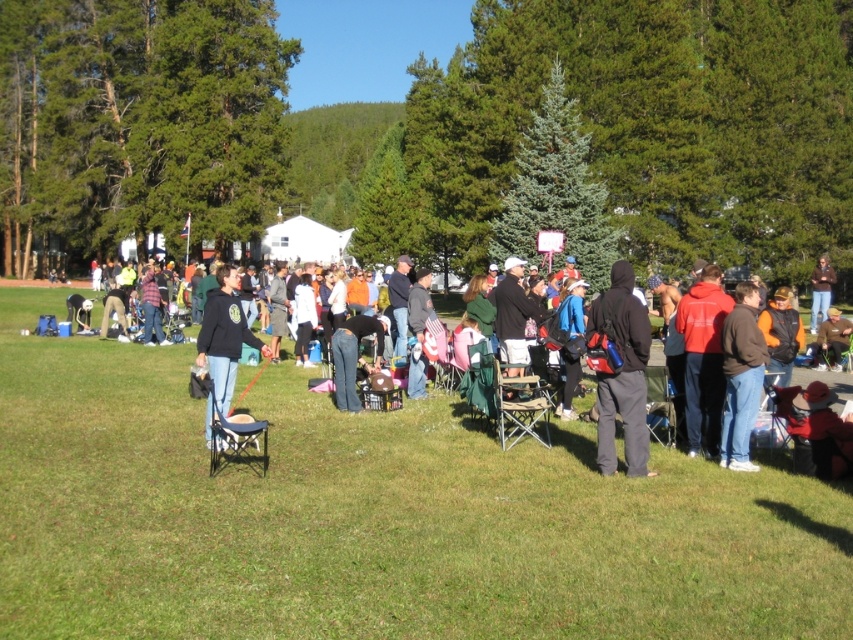
You are a photographer standing at the camera position. You want to take a photo that includes both the point at (631, 426) and the point at (357, 339). Which point should you focus on first to ensure both are in focus?

You should focus on the point at (357, 339) first because it is farther from the camera than the point at (631, 426). By focusing on the farther point, the closer point will also be within the depth of field, ensuring both are in focus.

You are organizing a clothing swap event at the park and need to sort items by size. You find a matte black hoodie at center and jeans at center. Which item should you place in the small items section?

The matte black hoodie at center is smaller than jeans at center, so it should be placed in the small items section.